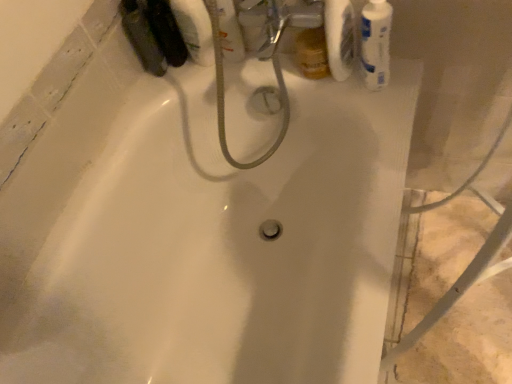
Question: Is the surface of white matte toilet paper at upper right in direct contact with matte black bottle at upper left, the 1th mouthwash in the left-to-right sequence?

Choices:
 (A) yes
 (B) no

Answer: (B)

Question: Can you confirm if white matte toilet paper at upper right is positioned to the left of matte black bottle at upper left, the third mouthwash in the right-to-left sequence?

Choices:
 (A) no
 (B) yes

Answer: (A)

Question: Does white matte toilet paper at upper right turn towards matte black bottle at upper left, the 1th mouthwash in the left-to-right sequence?

Choices:
 (A) no
 (B) yes

Answer: (A)

Question: From the image's perspective, is white matte toilet paper at upper right under matte black bottle at upper left, the 1th mouthwash in the left-to-right sequence?

Choices:
 (A) yes
 (B) no

Answer: (A)

Question: Does white matte toilet paper at upper right come behind matte black bottle at upper left, the 1th mouthwash in the left-to-right sequence?

Choices:
 (A) yes
 (B) no

Answer: (B)

Question: Is white matte toilet paper at upper right oriented away from matte black bottle at upper left, the third mouthwash in the right-to-left sequence?

Choices:
 (A) no
 (B) yes

Answer: (A)

Question: From the image's perspective, is clear plastic bottle at upper center, marked as the 2th mouthwash in a left-to-right arrangement, below white matte toilet paper at upper right?

Choices:
 (A) no
 (B) yes

Answer: (A)

Question: Considering the relative sizes of clear plastic bottle at upper center, which is the 2th mouthwash from right to left, and white matte toilet paper at upper right in the image provided, is clear plastic bottle at upper center, which is the 2th mouthwash from right to left, thinner than white matte toilet paper at upper right?

Choices:
 (A) no
 (B) yes

Answer: (B)

Question: Is clear plastic bottle at upper center, marked as the 2th mouthwash in a left-to-right arrangement, directly adjacent to white matte toilet paper at upper right?

Choices:
 (A) no
 (B) yes

Answer: (A)

Question: From a real-world perspective, is clear plastic bottle at upper center, which is the 2th mouthwash from right to left, below white matte toilet paper at upper right?

Choices:
 (A) no
 (B) yes

Answer: (B)

Question: Does clear plastic bottle at upper center, marked as the 2th mouthwash in a left-to-right arrangement, lie in front of white matte toilet paper at upper right?

Choices:
 (A) no
 (B) yes

Answer: (A)

Question: From the image's perspective, would you say clear plastic bottle at upper center, marked as the 2th mouthwash in a left-to-right arrangement, is positioned over white matte toilet paper at upper right?

Choices:
 (A) yes
 (B) no

Answer: (A)

Question: Can you confirm if white glossy mouthwash at upper right, arranged as the first mouthwash when viewed from the right, is positioned to the left of clear plastic bottle at upper center, which is the 2th mouthwash from right to left?

Choices:
 (A) no
 (B) yes

Answer: (A)